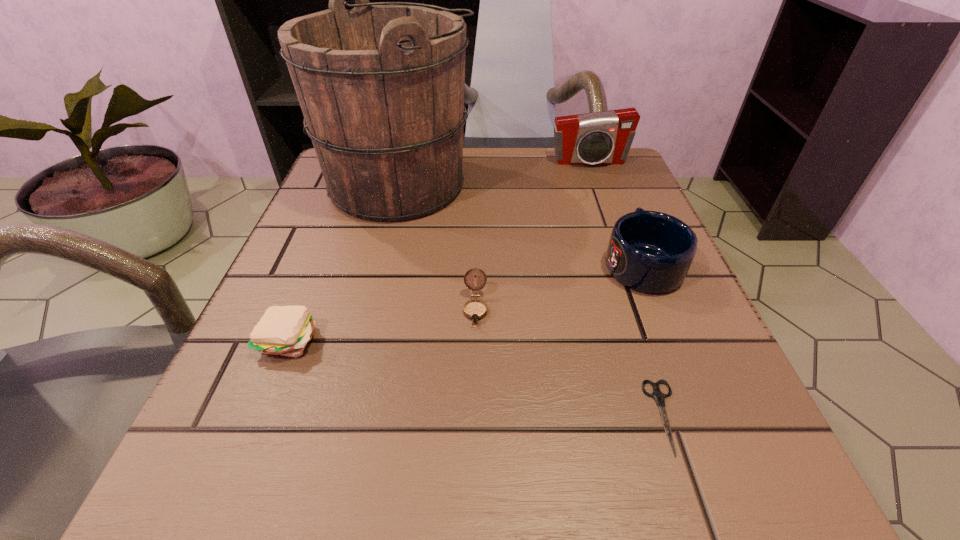
This screenshot has height=540, width=960. In the image, there is a desktop. What are the coordinates of `free region at the near left corner` in the screenshot? It's located at (182, 458).

This screenshot has width=960, height=540. I want to click on vacant area at the far right corner, so click(x=628, y=198).

Find the location of a particular element. This screenshot has height=540, width=960. vacant region between the compass and the bucket is located at coordinates (437, 246).

Find the location of `free space between the fourth shortest object and the patty`. free space between the fourth shortest object and the patty is located at coordinates (465, 301).

Find the location of a particular element. vacant space that is in between the bucket and the fourth shortest object is located at coordinates (520, 224).

The width and height of the screenshot is (960, 540). I want to click on free space between the shortest object and the tallest object, so click(x=532, y=301).

Image resolution: width=960 pixels, height=540 pixels. Identify the location of empty location between the third tallest object and the patty. 465,301.

The width and height of the screenshot is (960, 540). What are the coordinates of `empty location between the fourth shortest object and the fifth shortest object` in the screenshot? It's located at (615, 213).

Identify the location of free space between the mug and the bucket. This screenshot has width=960, height=540. (520, 224).

You are a GUI agent. You are given a task and a screenshot of the screen. Output one action in this format:
    pyautogui.click(x=<x>, y=<y>)
    Task: Click on the free space between the bucket and the camera
    
    Given the screenshot: What is the action you would take?
    pyautogui.click(x=494, y=173)